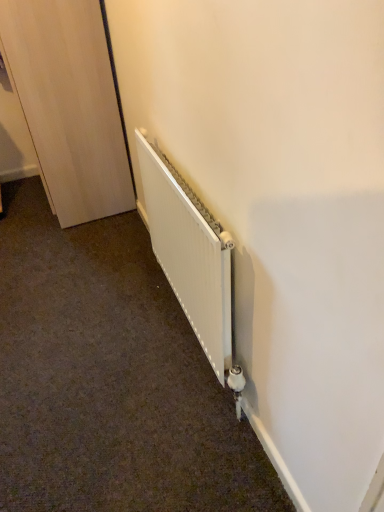
Question: Considering the positions of light wood door at left and white matte radiator at lower center in the image, is light wood door at left bigger or smaller than white matte radiator at lower center?

Choices:
 (A) small
 (B) big

Answer: (B)

Question: In terms of width, does light wood door at left look wider or thinner when compared to white matte radiator at lower center?

Choices:
 (A) thin
 (B) wide

Answer: (B)

Question: Does point pos(104,166) appear closer or farther from the camera than point pos(210,347)?

Choices:
 (A) closer
 (B) farther

Answer: (B)

Question: Considering their positions, is white matte radiator at lower center located in front of or behind light wood door at left?

Choices:
 (A) behind
 (B) front

Answer: (B)

Question: Is point (190, 293) closer or farther from the camera than point (51, 112)?

Choices:
 (A) farther
 (B) closer

Answer: (B)

Question: From the image's perspective, relative to light wood door at left, is white matte radiator at lower center above or below?

Choices:
 (A) above
 (B) below

Answer: (B)

Question: In terms of size, does white matte radiator at lower center appear bigger or smaller than light wood door at left?

Choices:
 (A) big
 (B) small

Answer: (B)